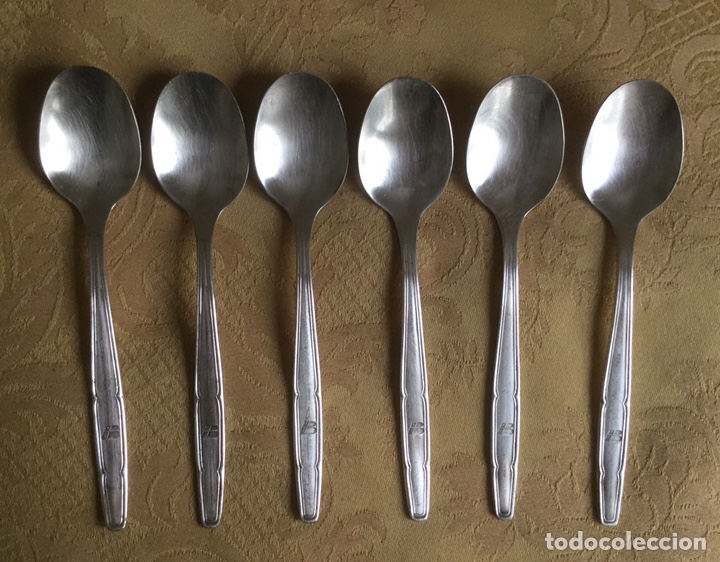
This screenshot has height=562, width=720. In order to click on spoon handles in this screenshot , I will do `click(107, 472)`, `click(207, 464)`, `click(304, 460)`, `click(417, 459)`, `click(503, 463)`, `click(613, 460)`.